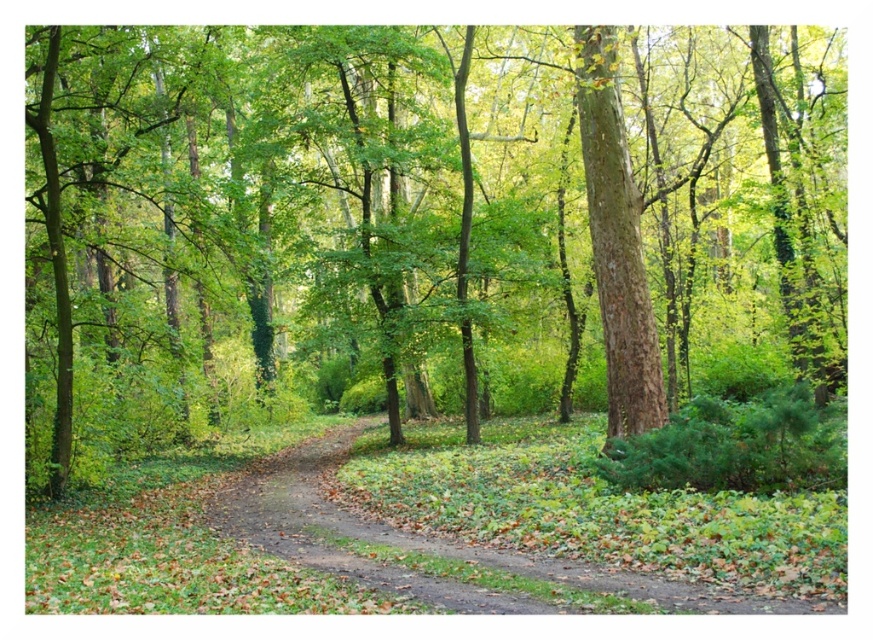
Question: Is brown dirt path at center smaller than smooth brown tree at center-right?

Choices:
 (A) no
 (B) yes

Answer: (A)

Question: Which point appears closest to the camera in this image?

Choices:
 (A) (624, 314)
 (B) (521, 554)
 (C) (327, 49)

Answer: (B)

Question: Which of the following is the closest to the observer?

Choices:
 (A) brown rough tree at center
 (B) brown dirt path at center
 (C) smooth brown tree at center-right

Answer: (B)

Question: Can you confirm if brown rough tree at center is positioned below brown dirt path at center?

Choices:
 (A) yes
 (B) no

Answer: (B)

Question: Does brown rough tree at center have a smaller size compared to smooth brown tree at center-right?

Choices:
 (A) yes
 (B) no

Answer: (B)

Question: Which object is the farthest from the smooth brown tree at center-right?

Choices:
 (A) brown dirt path at center
 (B) brown rough tree at center

Answer: (B)